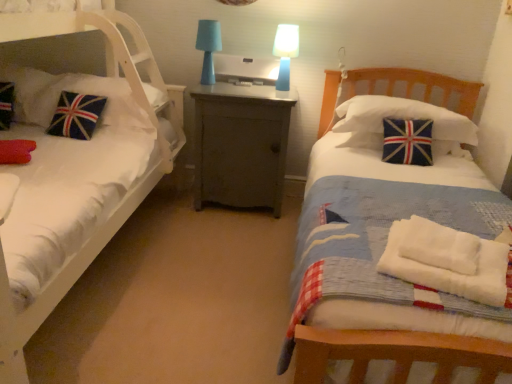
Question: Which is correct: blue fabric lampshade at center, arranged as the first table lamp when viewed from the left, is inside union jack fabric pillow at left, the 1th pillow in the left-to-right sequence, or outside of it?

Choices:
 (A) outside
 (B) inside

Answer: (A)

Question: From a real-world perspective, is blue fabric lampshade at center, arranged as the first table lamp when viewed from the left, above or below union jack fabric pillow at left, the 1th pillow in the left-to-right sequence?

Choices:
 (A) above
 (B) below

Answer: (A)

Question: Estimate the real-world distances between objects in this image. Which object is farther from the white cotton towels at lower right?

Choices:
 (A) white fabric bed at left
 (B) blue plastic table lamp at upper center, acting as the second table lamp starting from the left
 (C) blue fabric lampshade at center, which is counted as the second table lamp, starting from the right
 (D) velvet union jack pillow at left, which ranks as the 2th pillow in left-to-right order
 (E) union jack fabric pillow at left, the 1th pillow in the left-to-right sequence

Answer: (E)

Question: Based on their relative distances, which object is farther from the velvet union jack pillow at left, which ranks as the 2th pillow in left-to-right order?

Choices:
 (A) union jack fabric pillow at left, positioned as the 3th pillow in right-to-left order
 (B) blue plastic table lamp at upper center, acting as the second table lamp starting from the left
 (C) white fabric bed at left
 (D) matte gray cabinet at center
 (E) blue fabric lampshade at center, which is counted as the second table lamp, starting from the right

Answer: (B)